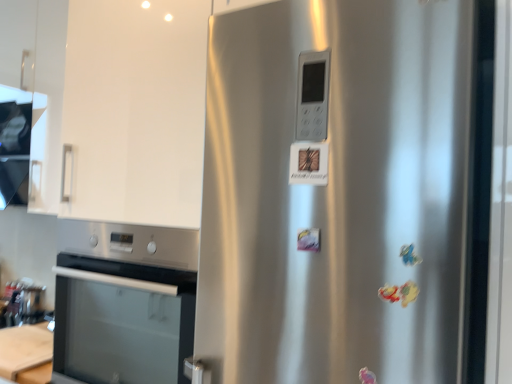
Question: Can you confirm if brushed metal toaster at lower left is shorter than stainless steel oven at lower left?

Choices:
 (A) yes
 (B) no

Answer: (A)

Question: Is brushed metal toaster at lower left thinner than stainless steel oven at lower left?

Choices:
 (A) yes
 (B) no

Answer: (A)

Question: Is stainless steel oven at lower left inside brushed metal toaster at lower left?

Choices:
 (A) yes
 (B) no

Answer: (B)

Question: From the image's perspective, would you say brushed metal toaster at lower left is shown under stainless steel oven at lower left?

Choices:
 (A) no
 (B) yes

Answer: (B)

Question: Is brushed metal toaster at lower left wider than stainless steel oven at lower left?

Choices:
 (A) no
 (B) yes

Answer: (A)

Question: From a real-world perspective, is white glossy cabinet at upper left above or below satin silver fridge at center?

Choices:
 (A) above
 (B) below

Answer: (A)

Question: In terms of size, does white glossy cabinet at upper left appear bigger or smaller than satin silver fridge at center?

Choices:
 (A) big
 (B) small

Answer: (A)

Question: Does point (47, 76) appear closer or farther from the camera than point (423, 299)?

Choices:
 (A) closer
 (B) farther

Answer: (B)

Question: Considering the relative positions of white glossy cabinet at upper left and satin silver fridge at center in the image provided, is white glossy cabinet at upper left to the left or to the right of satin silver fridge at center?

Choices:
 (A) left
 (B) right

Answer: (A)

Question: From a real-world perspective, relative to satin silver fridge at center, is brushed metal toaster at lower left vertically above or below?

Choices:
 (A) below
 (B) above

Answer: (A)

Question: From the image's perspective, is brushed metal toaster at lower left above or below satin silver fridge at center?

Choices:
 (A) below
 (B) above

Answer: (A)

Question: Based on their sizes in the image, would you say brushed metal toaster at lower left is bigger or smaller than satin silver fridge at center?

Choices:
 (A) small
 (B) big

Answer: (A)

Question: Based on their positions, is brushed metal toaster at lower left located to the left or right of satin silver fridge at center?

Choices:
 (A) right
 (B) left

Answer: (B)

Question: From a real-world perspective, is stainless steel oven at lower left positioned above or below brushed metal toaster at lower left?

Choices:
 (A) above
 (B) below

Answer: (A)

Question: Considering the positions of stainless steel oven at lower left and brushed metal toaster at lower left in the image, is stainless steel oven at lower left taller or shorter than brushed metal toaster at lower left?

Choices:
 (A) tall
 (B) short

Answer: (A)